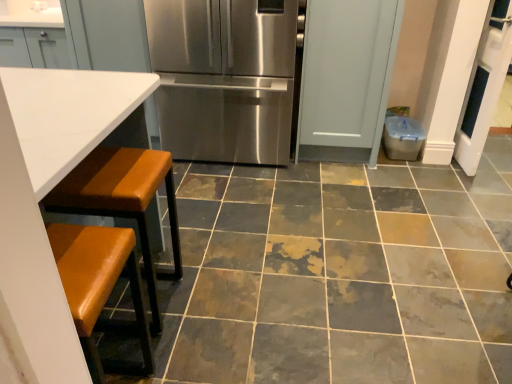
At what (x,y) coordinates should I click in order to perform the action: click on empty space that is ontop of brown leather stool at lower left (from a real-world perspective). Please return your answer as a coordinate pair (x, y). This screenshot has width=512, height=384. Looking at the image, I should click on (110, 169).